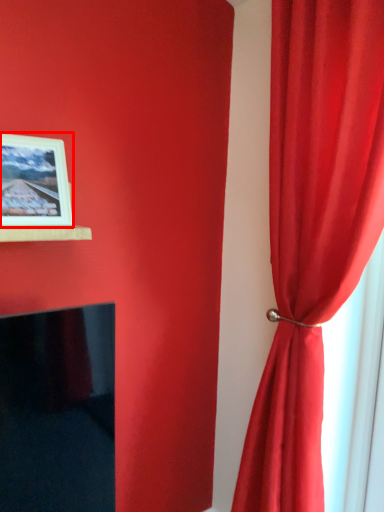
Question: From the image, what is the correct spatial relationship of picture frame (annotated by the red box) in relation to curtain?

Choices:
 (A) left
 (B) right

Answer: (A)